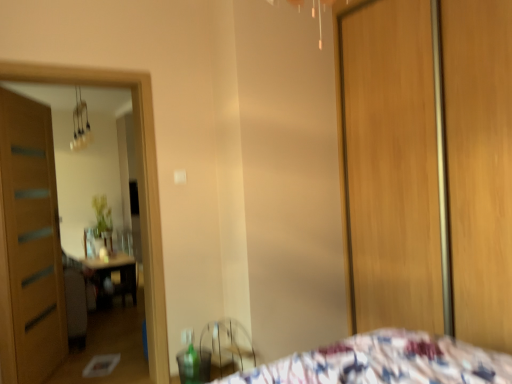
Question: Choose the correct answer: Is metallic glass chandelier at upper left inside wooden door at left or outside it?

Choices:
 (A) inside
 (B) outside

Answer: (B)

Question: Is metallic glass chandelier at upper left taller or shorter than wooden door at left?

Choices:
 (A) tall
 (B) short

Answer: (B)

Question: Which object is the closest to the metallic glass chandelier at upper left?

Choices:
 (A) wooden screen door at right
 (B) wooden door at left

Answer: (B)

Question: Estimate the real-world distances between objects in this image. Which object is farther from the metallic glass chandelier at upper left?

Choices:
 (A) wooden door at left
 (B) wooden screen door at right

Answer: (B)